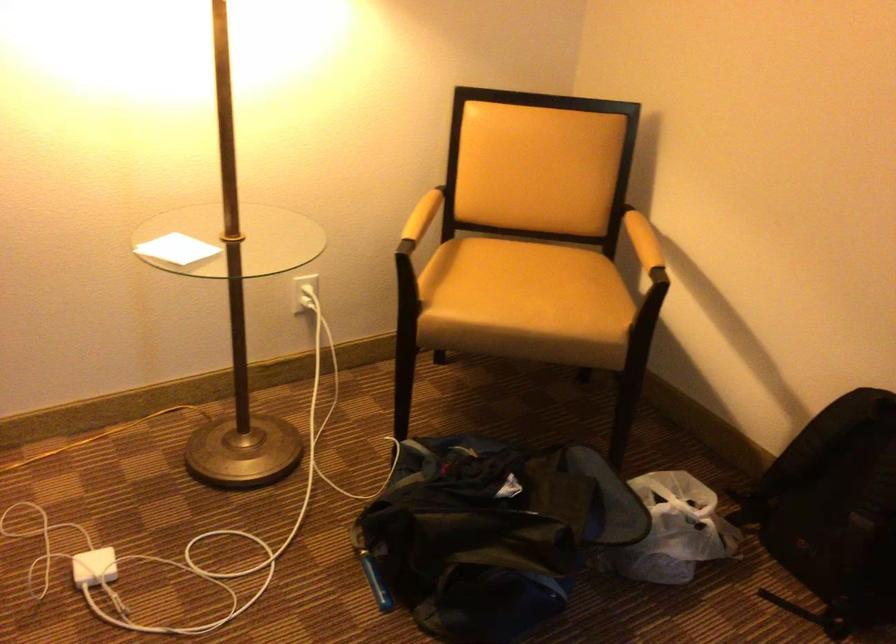
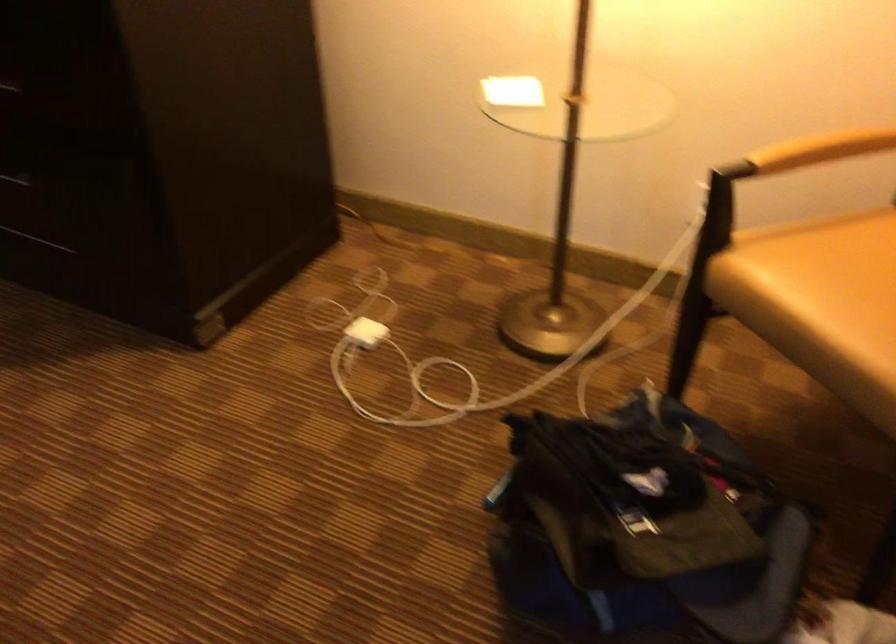
The point at (521,314) is marked in the first image. Where is the corresponding point in the second image?

(821, 303)